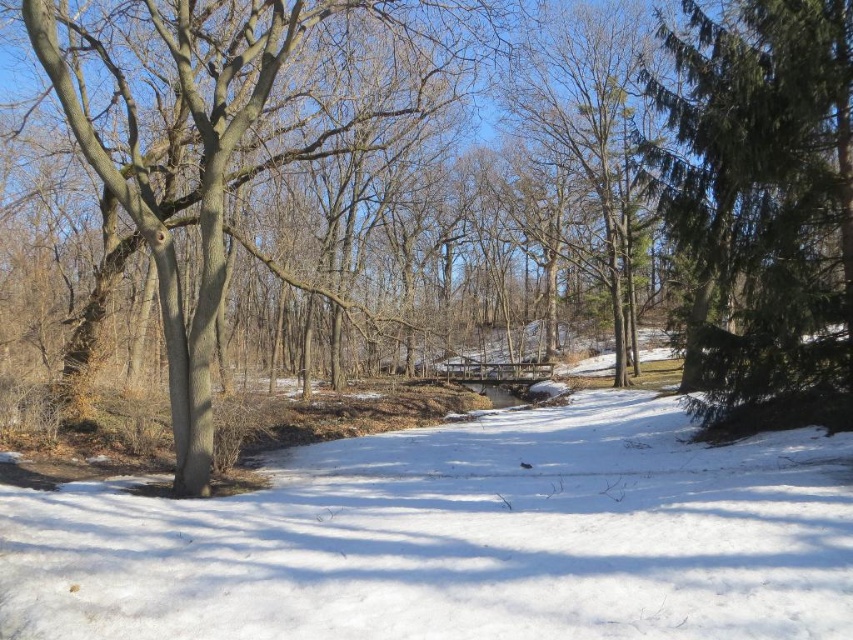
You are an explorer trying to cross the wooden bridge in the winter landscape. You notice the white powdery snow at center and the brown bark tree at left. Which object is closer to you as you stand on the bridge?

The white powdery snow at center is closer to you because it is in front of the brown bark tree at left, meaning the snow is positioned nearer to your viewpoint on the bridge.